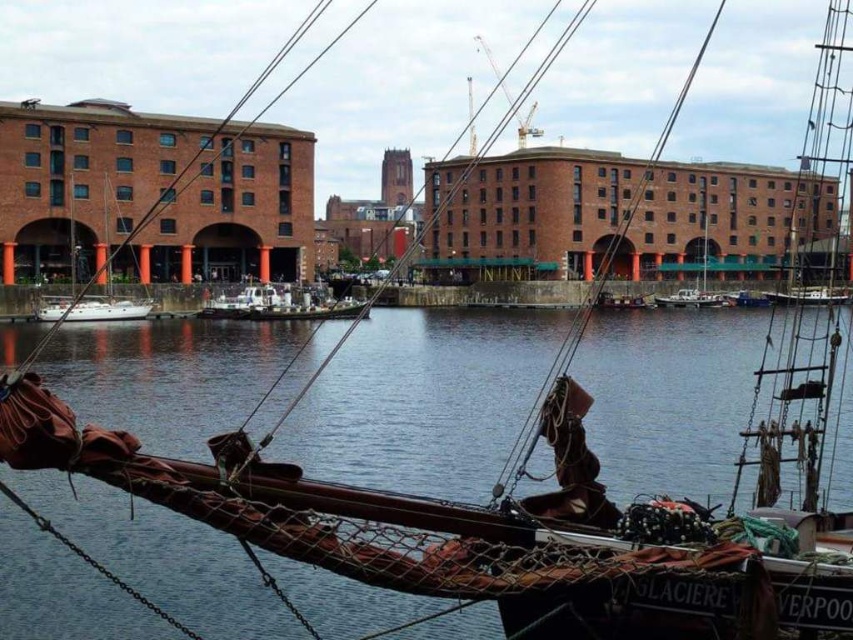
In the scene shown: You are standing on the deck of the ship and want to locate the transparent water at center. According to the coordinates provided, where exactly should you look?

The transparent water at center is located at point coordinates of 0.623 on the x axis and 0.491 on the y axis.